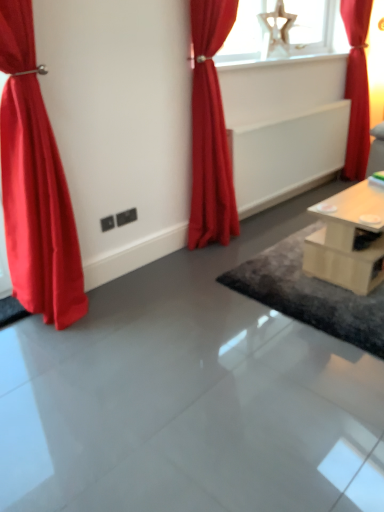
Locate an element on the screen. The width and height of the screenshot is (384, 512). vacant area in front of matte red curtain at left, arranged as the first curtain when viewed from the front is located at coordinates (54, 365).